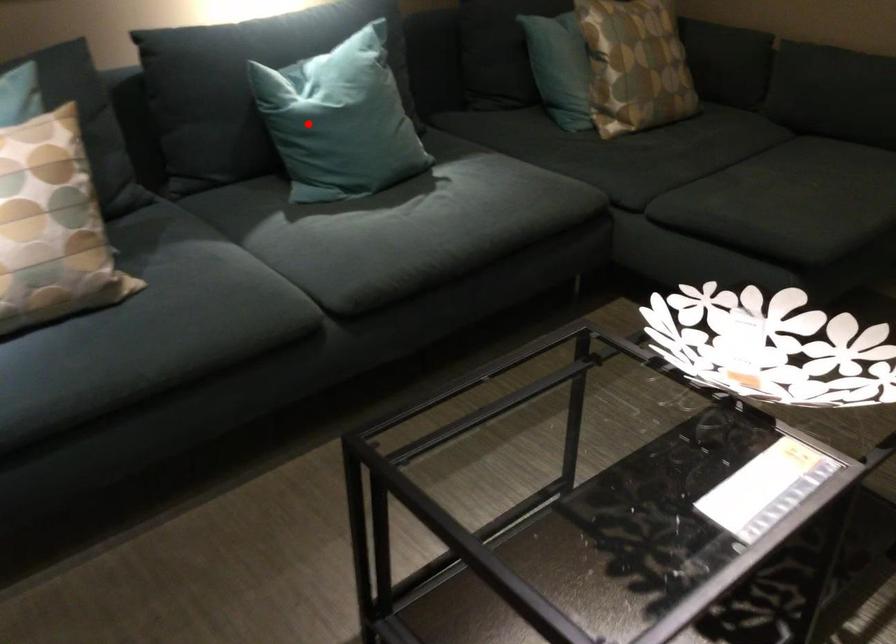
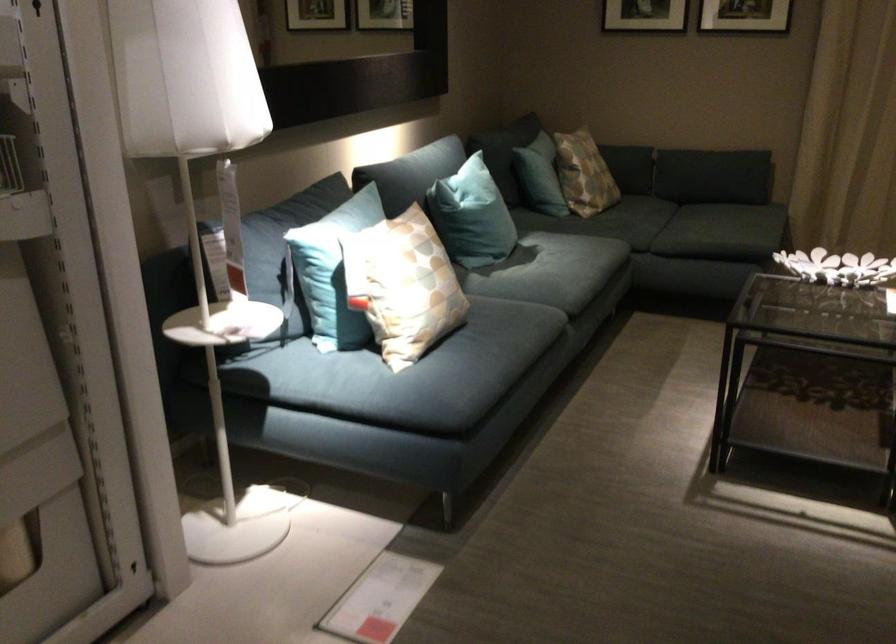
Where in the second image is the point corresponding to the highlighted location from the first image?

(471, 216)